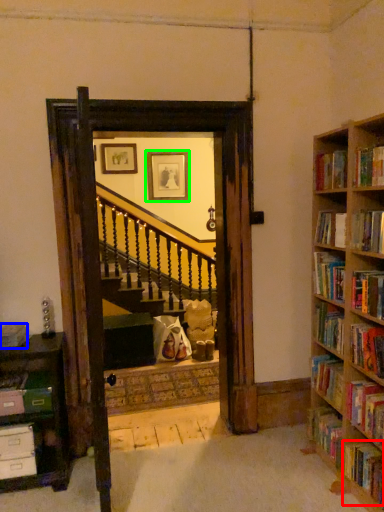
Question: Which is nearer to the book (highlighted by a red box)? book (highlighted by a blue box) or picture frame (highlighted by a green box).

Choices:
 (A) book
 (B) picture frame

Answer: (A)